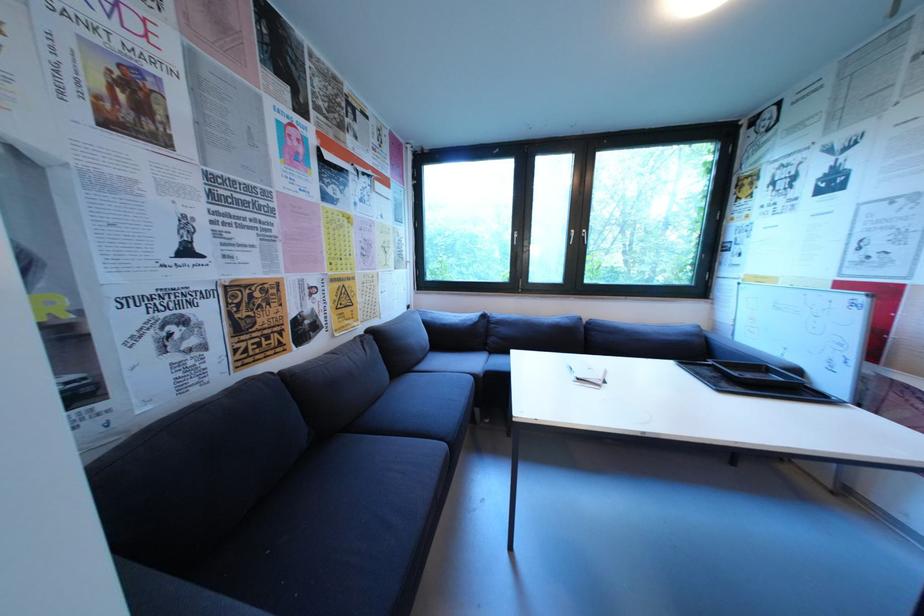
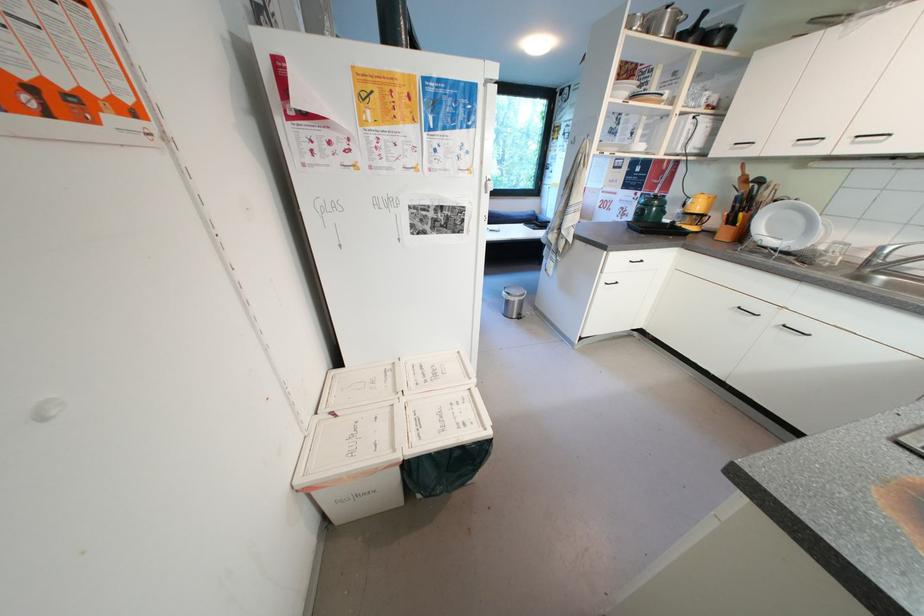
Question: I am providing you with two images of the same scene from different viewpoints. After the viewpoint changes to image2, which objects are now occluded?

Choices:
 (A) green pot lid
 (B) white bin lid
 (C) orange bottle pump
 (D) folded white paper

Answer: (D)